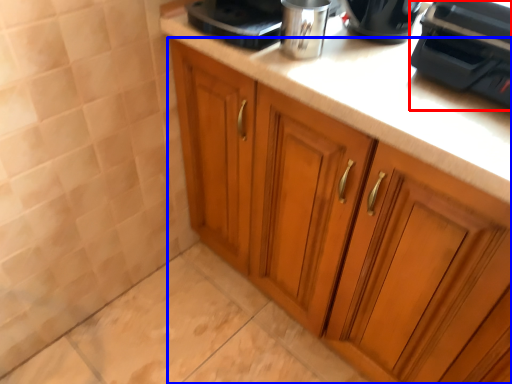
Question: Which object is further to the camera taking this photo, home appliance (highlighted by a red box) or cabinetry (highlighted by a blue box)?

Choices:
 (A) home appliance
 (B) cabinetry

Answer: (A)